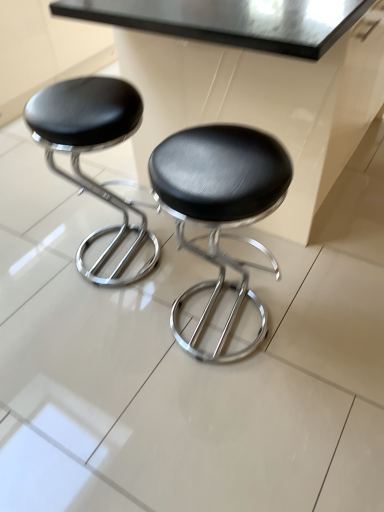
I want to click on black leather stool at left, marked as the first stool in a left-to-right arrangement, so click(91, 150).

The height and width of the screenshot is (512, 384). I want to click on metallic black table at upper center, so click(253, 78).

Identify the location of black leather stool at center, the second stool when ordered from left to right. Image resolution: width=384 pixels, height=512 pixels. tap(220, 208).

Is metallic black table at upper center beside black leather stool at left, marked as the first stool in a left-to-right arrangement?

No, metallic black table at upper center is not making contact with black leather stool at left, marked as the first stool in a left-to-right arrangement.

Considering the sizes of objects metallic black table at upper center and black leather stool at left, which appears as the second stool when viewed from the right, in the image provided, who is bigger, metallic black table at upper center or black leather stool at left, which appears as the second stool when viewed from the right,?

metallic black table at upper center is bigger.

From the picture: Which is more to the left, metallic black table at upper center or black leather stool at left, which appears as the second stool when viewed from the right?

From the viewer's perspective, black leather stool at left, which appears as the second stool when viewed from the right, appears more on the left side.

Is metallic black table at upper center aimed at black leather stool at left, which appears as the second stool when viewed from the right?

Yes, metallic black table at upper center is turned towards black leather stool at left, which appears as the second stool when viewed from the right.

Is black leather stool at left, which appears as the second stool when viewed from the right, positioned beyond the bounds of black leather stool at center, arranged as the 1th stool when viewed from the right?

Yes, black leather stool at left, which appears as the second stool when viewed from the right, is located beyond the bounds of black leather stool at center, arranged as the 1th stool when viewed from the right.

Is black leather stool at left, which appears as the second stool when viewed from the right, with black leather stool at center, the second stool when ordered from left to right?

No, black leather stool at left, which appears as the second stool when viewed from the right, is not next to black leather stool at center, the second stool when ordered from left to right.

From the image's perspective, is black leather stool at left, which appears as the second stool when viewed from the right, located above black leather stool at center, the second stool when ordered from left to right?

Yes, from the image's perspective, black leather stool at left, which appears as the second stool when viewed from the right, is above black leather stool at center, the second stool when ordered from left to right.

Can you confirm if black leather stool at left, marked as the first stool in a left-to-right arrangement, is positioned to the left of black leather stool at center, the second stool when ordered from left to right?

Correct, you'll find black leather stool at left, marked as the first stool in a left-to-right arrangement, to the left of black leather stool at center, the second stool when ordered from left to right.

Is black leather stool at center, arranged as the 1th stool when viewed from the right, at the left side of black leather stool at left, marked as the first stool in a left-to-right arrangement?

No.

From the image's perspective, which is above, black leather stool at center, arranged as the 1th stool when viewed from the right, or black leather stool at left, marked as the first stool in a left-to-right arrangement?

black leather stool at left, marked as the first stool in a left-to-right arrangement.

Is point (215, 205) farther from viewer compared to point (92, 78)?

No, (215, 205) is closer to viewer.

Can you see black leather stool at center, arranged as the 1th stool when viewed from the right, touching black leather stool at left, marked as the first stool in a left-to-right arrangement?

No, black leather stool at center, arranged as the 1th stool when viewed from the right, is not touching black leather stool at left, marked as the first stool in a left-to-right arrangement.

Between metallic black table at upper center and black leather stool at center, arranged as the 1th stool when viewed from the right, which one has larger size?

metallic black table at upper center.

Does point (291, 33) come in front of point (207, 306)?

That is True.

Consider the image. What's the angular difference between metallic black table at upper center and black leather stool at center, arranged as the 1th stool when viewed from the right,'s facing directions?

metallic black table at upper center and black leather stool at center, arranged as the 1th stool when viewed from the right, are facing 178 degrees away from each other.

In the scene shown: How far apart are black leather stool at left, which appears as the second stool when viewed from the right, and metallic black table at upper center?

black leather stool at left, which appears as the second stool when viewed from the right, and metallic black table at upper center are 16.83 inches apart from each other.

From a real-world perspective, between black leather stool at left, marked as the first stool in a left-to-right arrangement, and metallic black table at upper center, who is vertically lower?

black leather stool at left, marked as the first stool in a left-to-right arrangement, is physically lower.

From the image's perspective, which one is positioned lower, black leather stool at left, marked as the first stool in a left-to-right arrangement, or metallic black table at upper center?

black leather stool at left, marked as the first stool in a left-to-right arrangement, appears lower in the image.

Considering the relative sizes of black leather stool at left, which appears as the second stool when viewed from the right, and metallic black table at upper center in the image provided, is black leather stool at left, which appears as the second stool when viewed from the right, shorter than metallic black table at upper center?

Indeed, black leather stool at left, which appears as the second stool when viewed from the right, has a lesser height compared to metallic black table at upper center.

From their relative heights in the image, would you say black leather stool at center, arranged as the 1th stool when viewed from the right, is taller or shorter than metallic black table at upper center?

Clearly, black leather stool at center, arranged as the 1th stool when viewed from the right, is shorter compared to metallic black table at upper center.

In the scene shown: Would you say black leather stool at center, arranged as the 1th stool when viewed from the right, is to the left or to the right of metallic black table at upper center in the picture?

From the image, it's evident that black leather stool at center, arranged as the 1th stool when viewed from the right, is to the left of metallic black table at upper center.

From the image's perspective, between black leather stool at center, the second stool when ordered from left to right, and metallic black table at upper center, who is located below?

black leather stool at center, the second stool when ordered from left to right.

The height and width of the screenshot is (512, 384). I want to click on table in front of the black leather stool at left, marked as the first stool in a left-to-right arrangement, so click(x=253, y=78).

You are a GUI agent. You are given a task and a screenshot of the screen. Output one action in this format:
    pyautogui.click(x=<x>, y=<y>)
    Task: Click on the stool below the black leather stool at left, which appears as the second stool when viewed from the right (from a real-world perspective)
    
    Given the screenshot: What is the action you would take?
    pyautogui.click(x=220, y=208)

When comparing their distances from black leather stool at center, arranged as the 1th stool when viewed from the right, does metallic black table at upper center or black leather stool at left, marked as the first stool in a left-to-right arrangement, seem further?

Among the two, black leather stool at left, marked as the first stool in a left-to-right arrangement, is located further to black leather stool at center, arranged as the 1th stool when viewed from the right.

Which object lies further to the anchor point black leather stool at center, the second stool when ordered from left to right, black leather stool at left, which appears as the second stool when viewed from the right, or metallic black table at upper center?

black leather stool at left, which appears as the second stool when viewed from the right, lies further to black leather stool at center, the second stool when ordered from left to right, than the other object.

Estimate the real-world distances between objects in this image. Which object is closer to metallic black table at upper center, black leather stool at center, arranged as the 1th stool when viewed from the right, or black leather stool at left, which appears as the second stool when viewed from the right?

The object closer to metallic black table at upper center is black leather stool at center, arranged as the 1th stool when viewed from the right.

Looking at this image, based on their spatial positions, is black leather stool at center, the second stool when ordered from left to right, or metallic black table at upper center further from black leather stool at left, marked as the first stool in a left-to-right arrangement?

black leather stool at center, the second stool when ordered from left to right, is positioned further to the anchor black leather stool at left, marked as the first stool in a left-to-right arrangement.

Which object lies nearer to the anchor point black leather stool at left, which appears as the second stool when viewed from the right, metallic black table at upper center or black leather stool at center, arranged as the 1th stool when viewed from the right?

metallic black table at upper center is positioned closer to the anchor black leather stool at left, which appears as the second stool when viewed from the right.

Considering their positions, is black leather stool at left, marked as the first stool in a left-to-right arrangement, positioned further to metallic black table at upper center than black leather stool at center, arranged as the 1th stool when viewed from the right?

Based on the image, black leather stool at left, marked as the first stool in a left-to-right arrangement, appears to be further to metallic black table at upper center.

Where is `stool that lies between metallic black table at upper center and black leather stool at center, arranged as the 1th stool when viewed from the right, from top to bottom`? The height and width of the screenshot is (512, 384). stool that lies between metallic black table at upper center and black leather stool at center, arranged as the 1th stool when viewed from the right, from top to bottom is located at coordinates (91, 150).